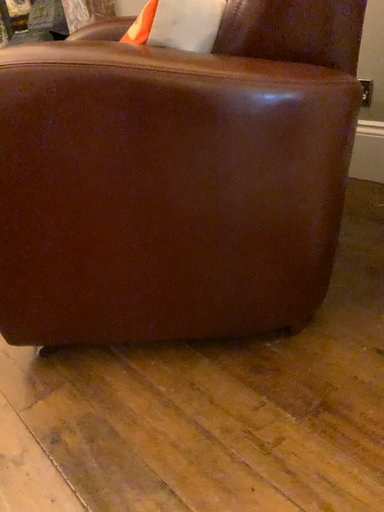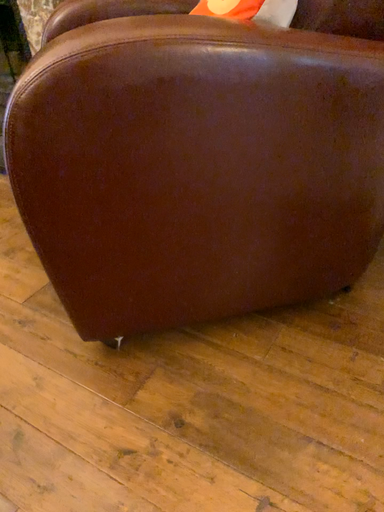
Question: Which way did the camera rotate in the video?

Choices:
 (A) rotated left
 (B) rotated right

Answer: (B)